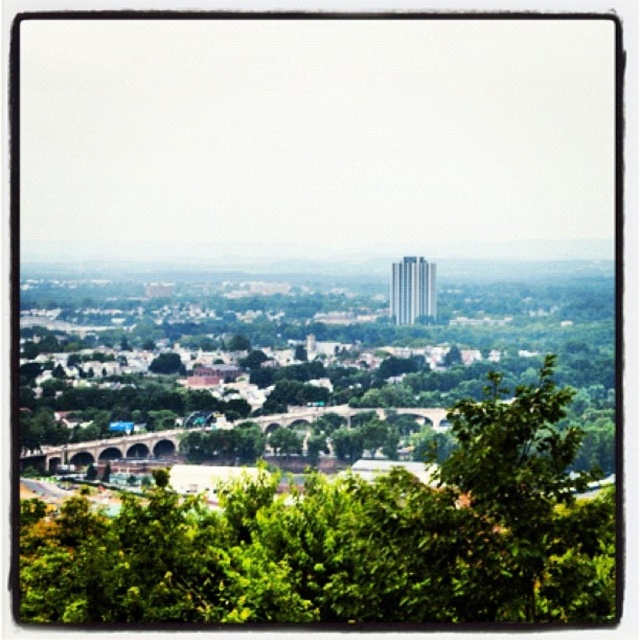
Which is above, green leafy tree at center or green leafy tree at lower right?

green leafy tree at lower right is above.

Looking at this image, is the position of green leafy tree at center more distant than that of green leafy tree at lower right?

No, it is in front of green leafy tree at lower right.

The width and height of the screenshot is (640, 640). Identify the location of green leafy tree at center. pyautogui.click(x=348, y=538).

Image resolution: width=640 pixels, height=640 pixels. In order to click on green leafy tree at center in this screenshot , I will do `click(348, 538)`.